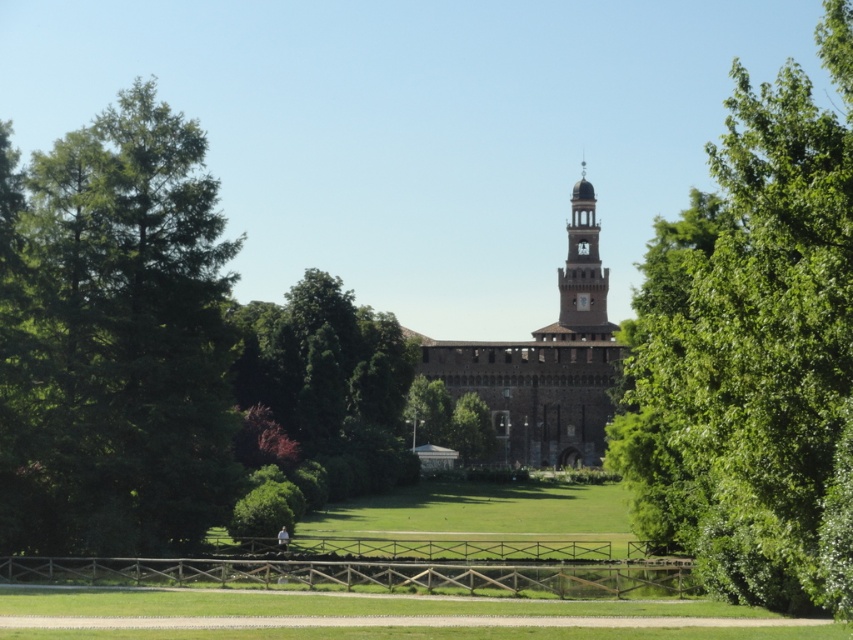
Does green leafy tree at left come in front of brown stone tower at center?

Yes, green leafy tree at left is in front of brown stone tower at center.

Which of these two, green leafy tree at left or brown stone tower at center, stands shorter?

brown stone tower at center

Is point (108, 460) positioned before point (549, 346)?

Yes, point (108, 460) is in front of point (549, 346).

You are a GUI agent. You are given a task and a screenshot of the screen. Output one action in this format:
    pyautogui.click(x=<x>, y=<y>)
    Task: Click on the green leafy tree at left
    The height and width of the screenshot is (640, 853).
    Given the screenshot: What is the action you would take?
    (113, 339)

Is brown stone tower at center wider than smooth stone bell tower at center?

Yes.

Does brown stone tower at center have a lesser height compared to smooth stone bell tower at center?

Incorrect, brown stone tower at center's height does not fall short of smooth stone bell tower at center's.

Is point (595, 296) more distant than point (613, 330)?

Yes, point (595, 296) is behind point (613, 330).

The height and width of the screenshot is (640, 853). Identify the location of brown stone tower at center. (544, 362).

At what (x,y) coordinates should I click in order to perform the action: click on green leafy tree at left. Please return your answer as a coordinate pair (x, y). Image resolution: width=853 pixels, height=640 pixels. Looking at the image, I should click on (113, 339).

Which is more to the right, green leafy tree at left or smooth stone bell tower at center?

Positioned to the right is smooth stone bell tower at center.

Measure the distance between point (171, 541) and camera.

Point (171, 541) is 520.13 feet from camera.

This screenshot has height=640, width=853. What are the coordinates of `green leafy tree at left` in the screenshot? It's located at (113, 339).